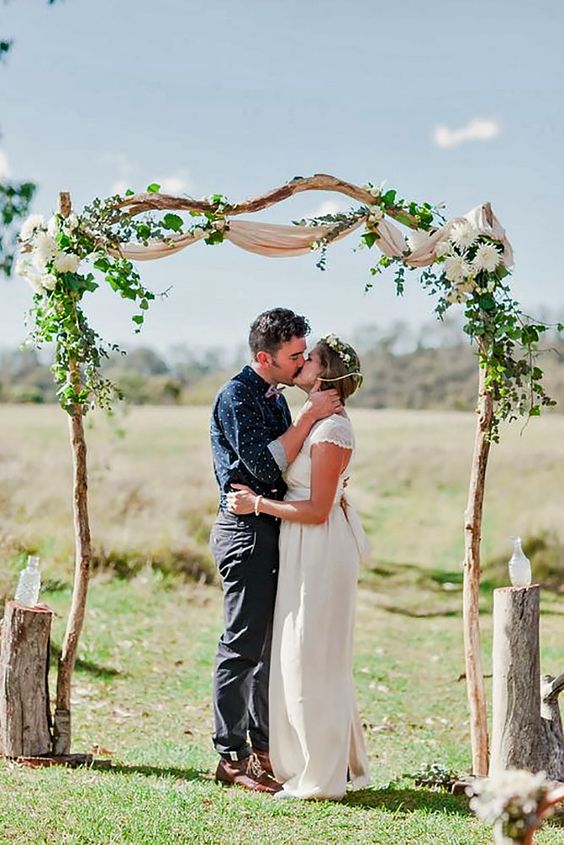
At what (x,y) coordinates should I click in order to perform the action: click on vase. Please return your answer as a coordinate pair (x, y). The height and width of the screenshot is (845, 564). Looking at the image, I should click on (522, 565), (26, 590).